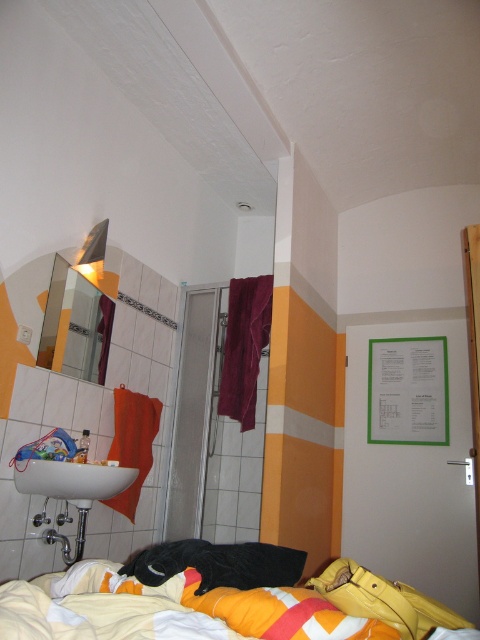
Question: Which point is farther to the camera?

Choices:
 (A) brushed metal faucet at sink left
 (B) clear glass mirror at upper left
 (C) green paperboard at right
 (D) yellow fabric bed at lower center

Answer: (C)

Question: Can you confirm if yellow fabric bed at lower center is bigger than brushed metal faucet at sink left?

Choices:
 (A) yes
 (B) no

Answer: (A)

Question: Does green paperboard at right have a smaller size compared to white glossy sink at lower left?

Choices:
 (A) yes
 (B) no

Answer: (B)

Question: Considering the relative positions of clear glass mirror at upper left and white glossy faucet at lower left in the image provided, where is clear glass mirror at upper left located with respect to white glossy faucet at lower left?

Choices:
 (A) left
 (B) right

Answer: (A)

Question: Which object appears farthest from the camera in this image?

Choices:
 (A) clear glass mirror at upper left
 (B) yellow fabric bed at lower center
 (C) white glossy faucet at lower left

Answer: (A)

Question: Based on their relative distances, which object is farther from the white glossy faucet at lower left?

Choices:
 (A) brushed metal faucet at sink left
 (B) white glossy sink at lower left
 (C) green paperboard at right
 (D) clear glass mirror at upper left

Answer: (C)